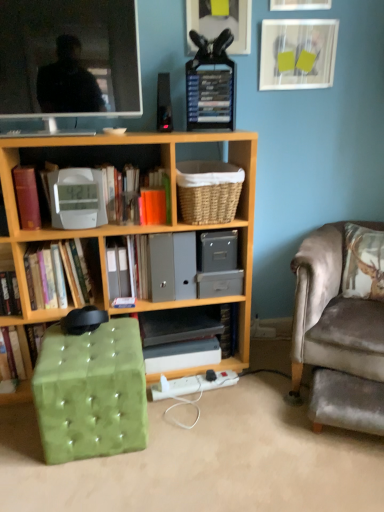
Where is `vacant area that lies between green tufted ottoman at lower left and velvet green footrest at lower right`? vacant area that lies between green tufted ottoman at lower left and velvet green footrest at lower right is located at coordinates (236, 428).